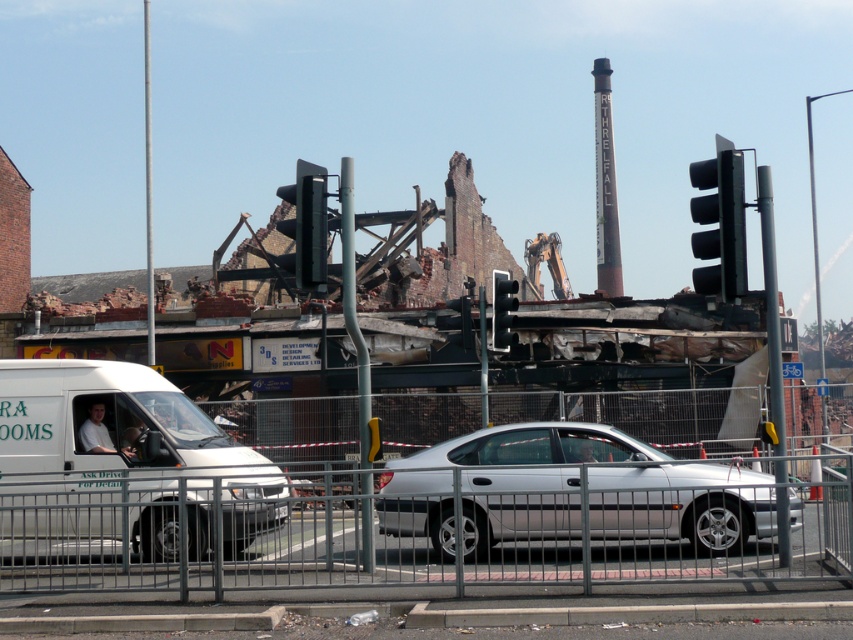
Can you confirm if silver metallic car at center is thinner than black plastic traffic light at upper right?

Yes.

Between silver metallic car at center and black plastic traffic light at upper right, which one is positioned lower?

silver metallic car at center is below.

The height and width of the screenshot is (640, 853). In order to click on silver metallic car at center in this screenshot , I will do `click(570, 492)`.

Find the location of `silver metallic car at center`. silver metallic car at center is located at coordinates click(x=570, y=492).

Who is positioned more to the left, metallic silver fence at lower center or black plastic traffic light at upper right?

Positioned to the left is metallic silver fence at lower center.

Does metallic silver fence at lower center have a lesser width compared to black plastic traffic light at upper right?

In fact, metallic silver fence at lower center might be wider than black plastic traffic light at upper right.

Is point (114, 516) closer to camera compared to point (727, 246)?

No, (114, 516) is behind (727, 246).

Find the location of `metallic silver fence at lower center`. metallic silver fence at lower center is located at coordinates (418, 528).

Can you confirm if metallic silver fence at lower center is positioned below black plastic traffic light at center?

Yes.

Does metallic silver fence at lower center have a larger size compared to black plastic traffic light at center?

Yes, metallic silver fence at lower center is bigger than black plastic traffic light at center.

Does point (654, 518) come closer to viewer compared to point (494, 348)?

Yes, it is.

The width and height of the screenshot is (853, 640). I want to click on metallic silver fence at lower center, so click(x=418, y=528).